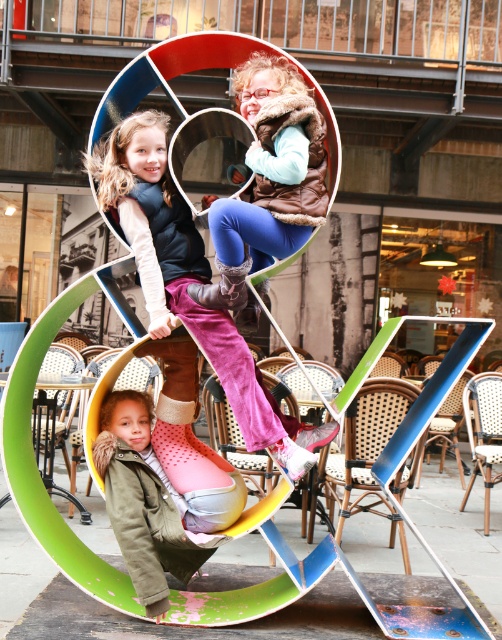
What is located at the coordinates point [185,275]?

At point [185,275] there are velvet pink pants at center.